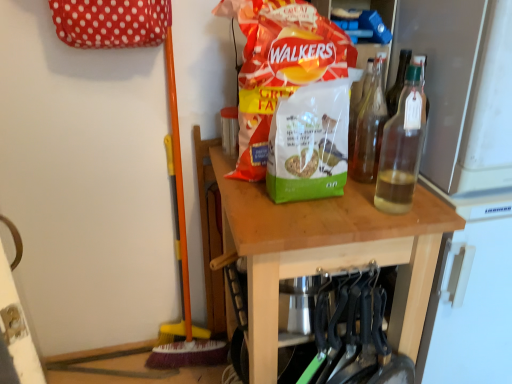
You are a GUI agent. You are given a task and a screenshot of the screen. Output one action in this format:
    pyautogui.click(x=<x>, y=<y>)
    Task: Click on the vacant point above wooden table at center (from a real-world perspective)
    Image resolution: width=512 pixels, height=384 pixels.
    Given the screenshot: What is the action you would take?
    pyautogui.click(x=333, y=196)